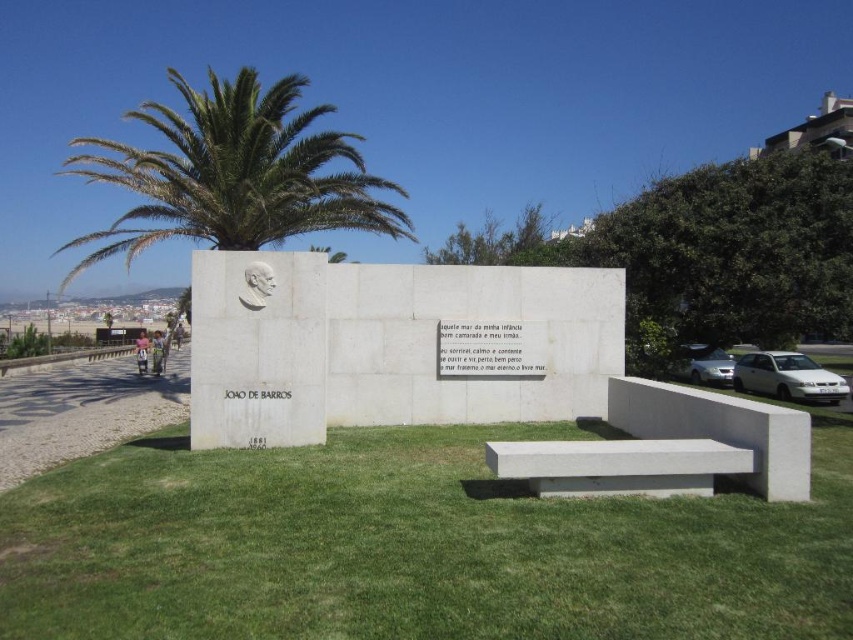
Who is positioned more to the left, green grass at center or white concrete bench at lower center?

green grass at center is more to the left.

Is point (457, 579) less distant than point (605, 486)?

Yes, point (457, 579) is in front of point (605, 486).

Who is more distant from viewer, (485,577) or (514,477)?

The point (514,477) is behind.

This screenshot has height=640, width=853. In order to click on green grass at center in this screenshot , I will do `click(410, 547)`.

Is white concrete bench at center bigger than white concrete bench at lower center?

Yes.

Does white concrete bench at center have a smaller size compared to white concrete bench at lower center?

Incorrect, white concrete bench at center is not smaller in size than white concrete bench at lower center.

You are a GUI agent. You are given a task and a screenshot of the screen. Output one action in this format:
    pyautogui.click(x=<x>, y=<y>)
    Task: Click on the white concrete bench at center
    The width and height of the screenshot is (853, 640).
    Given the screenshot: What is the action you would take?
    pyautogui.click(x=672, y=444)

The height and width of the screenshot is (640, 853). In order to click on white concrete bench at center in this screenshot , I will do [672, 444].

Who is shorter, green leafy palm tree at upper left or white concrete bench at lower center?

Standing shorter between the two is white concrete bench at lower center.

Which is in front, point (357, 227) or point (518, 452)?

Point (518, 452)

Where is `green leafy palm tree at upper left`? green leafy palm tree at upper left is located at coordinates (231, 173).